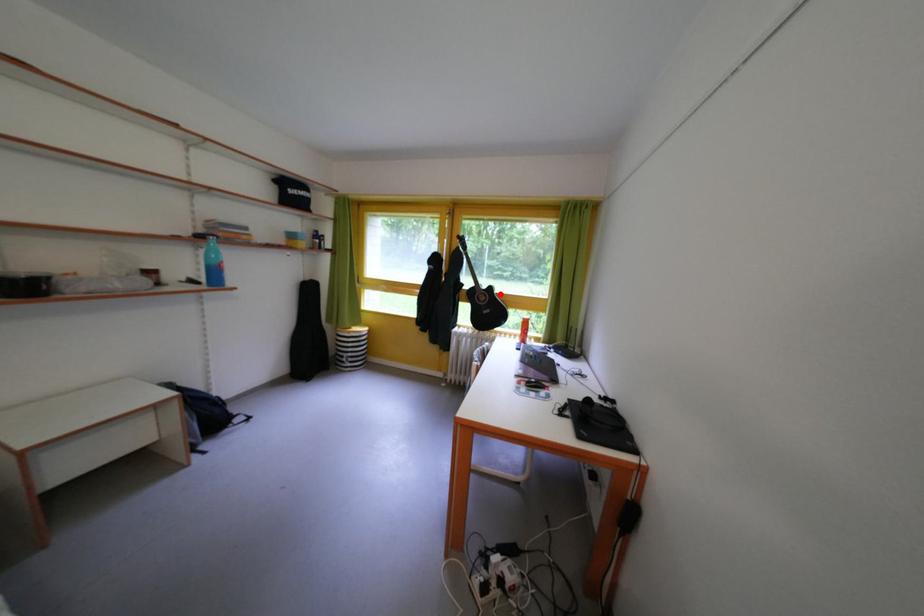
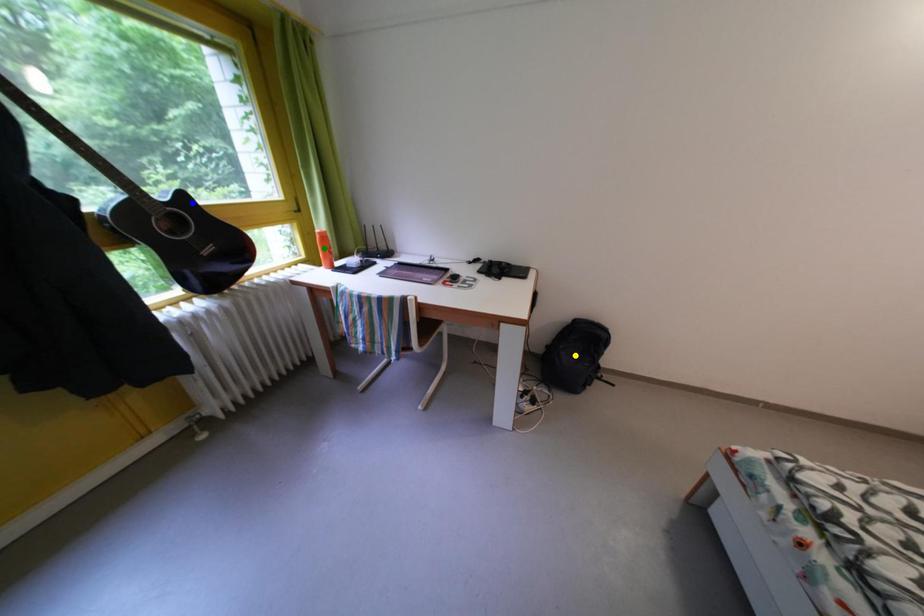
Question: I am providing you with two images of the same scene from different viewpoints. A red point is marked on the first image. You are given multiple points on the second image. In image 2, which mark is for the same physical point as the one in image 1?

Choices:
 (A) green point
 (B) yellow point
 (C) blue point

Answer: (C)